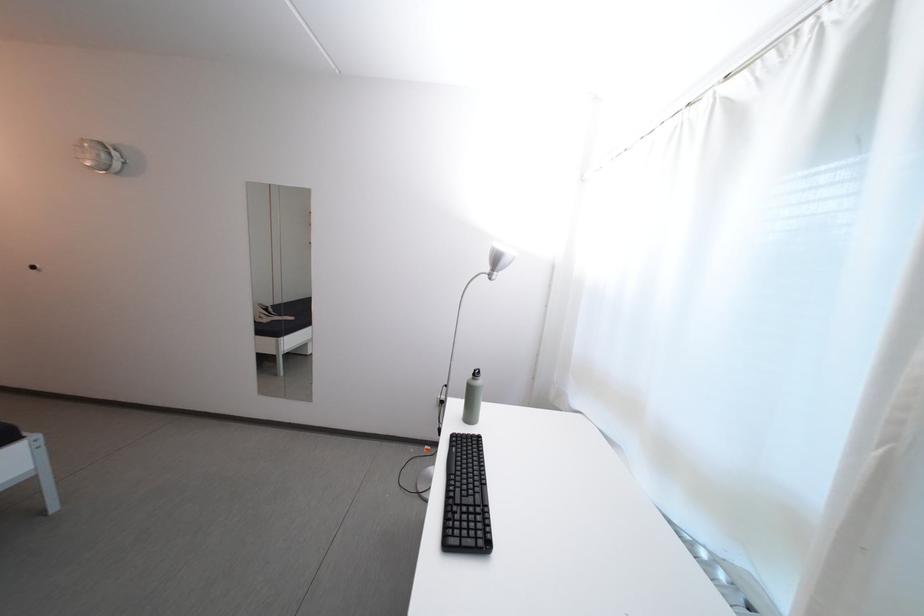
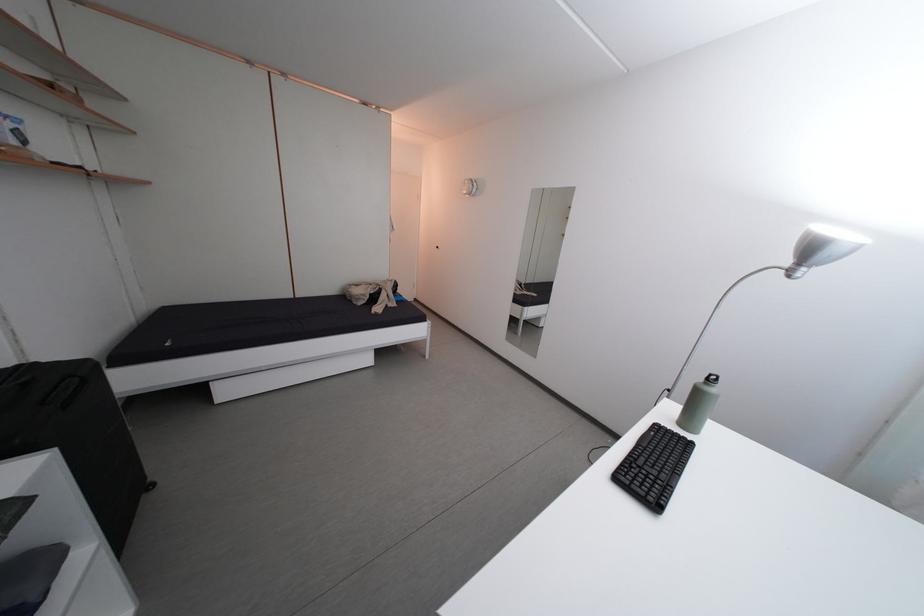
Question: The images are taken continuously from a first-person perspective. In which direction is your viewpoint rotating?

Choices:
 (A) Left
 (B) Right
 (C) Up
 (D) Down

Answer: (A)